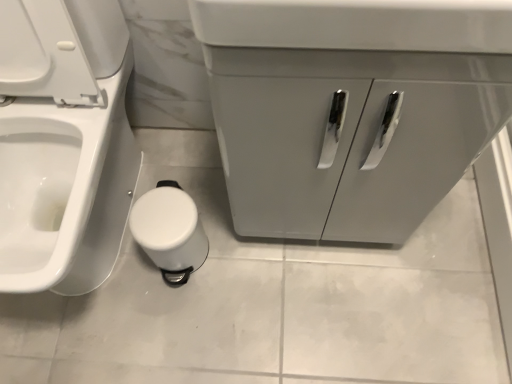
Identify the location of free area in between white glossy toilet at lower left and white plastic toilet paper at lower center. (197, 214).